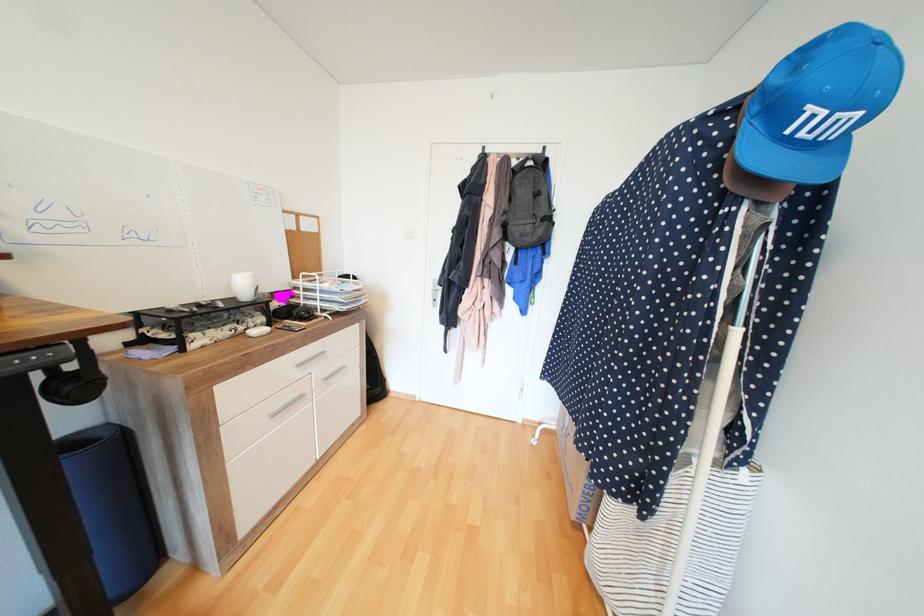
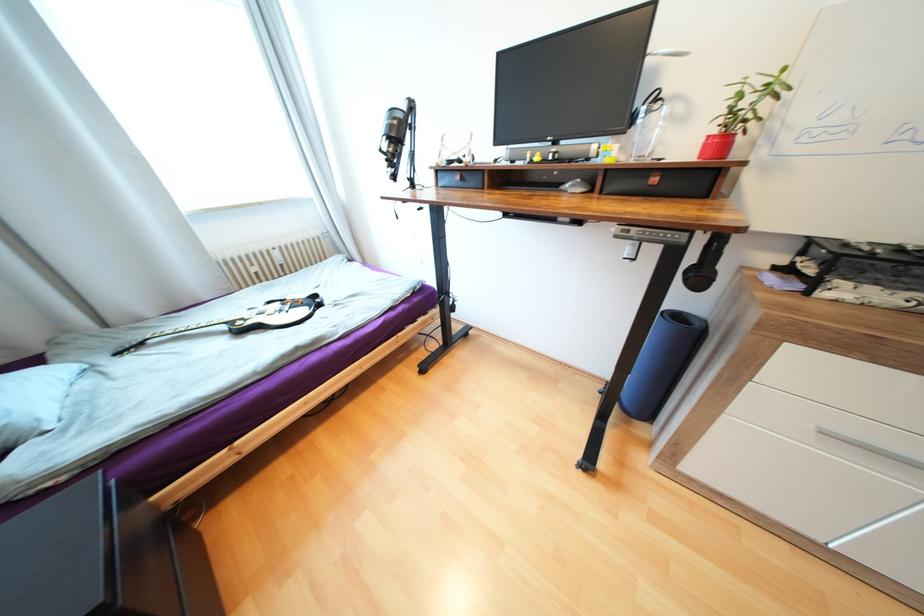
The images are taken continuously from a first-person perspective. In which direction is your viewpoint rotating?

The camera's rotation is toward left-down.